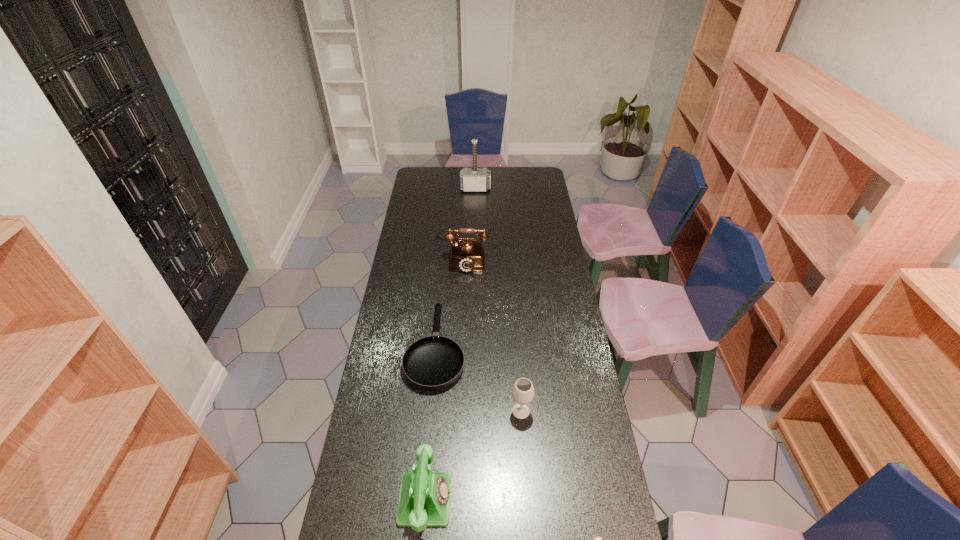
Locate an element on the screen. vacant space in between the frying pan and the fifth nearest object is located at coordinates (449, 303).

Where is `unoccupied area between the farther telephone and the wineglass`? This screenshot has height=540, width=960. unoccupied area between the farther telephone and the wineglass is located at coordinates (492, 335).

This screenshot has width=960, height=540. Find the location of `free space between the fifth nearest object and the fourth nearest object`. free space between the fifth nearest object and the fourth nearest object is located at coordinates (449, 303).

The height and width of the screenshot is (540, 960). What are the coordinates of `object that ranks as the second closest to the wineglass` in the screenshot? It's located at (424, 499).

Where is `object that is the third closest to the fourth farthest object`? The height and width of the screenshot is (540, 960). object that is the third closest to the fourth farthest object is located at coordinates (596, 539).

Locate an element on the screen. vacant area in the image that satisfies the following two spatial constraints: 1. on the dial of the wineglass; 2. on the left side of the farther telephone is located at coordinates (456, 411).

Where is `vacant space that satisfies the following two spatial constraints: 1. for striking with the head of the tallest object; 2. on the right side of the fifth object from left to right`? vacant space that satisfies the following two spatial constraints: 1. for striking with the head of the tallest object; 2. on the right side of the fifth object from left to right is located at coordinates (472, 411).